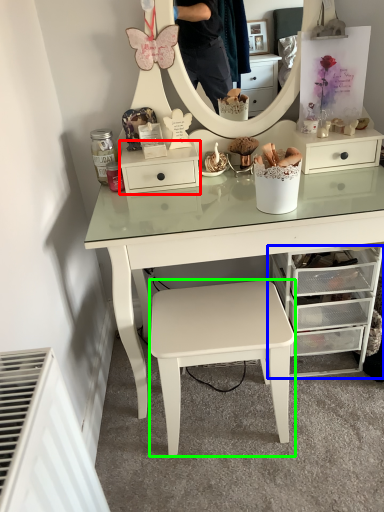
Question: Based on their relative distances, which object is nearer to nightstand (highlighted by a red box)? Choose from chest of drawers (highlighted by a blue box) and stool (highlighted by a green box).

Choices:
 (A) chest of drawers
 (B) stool

Answer: (B)